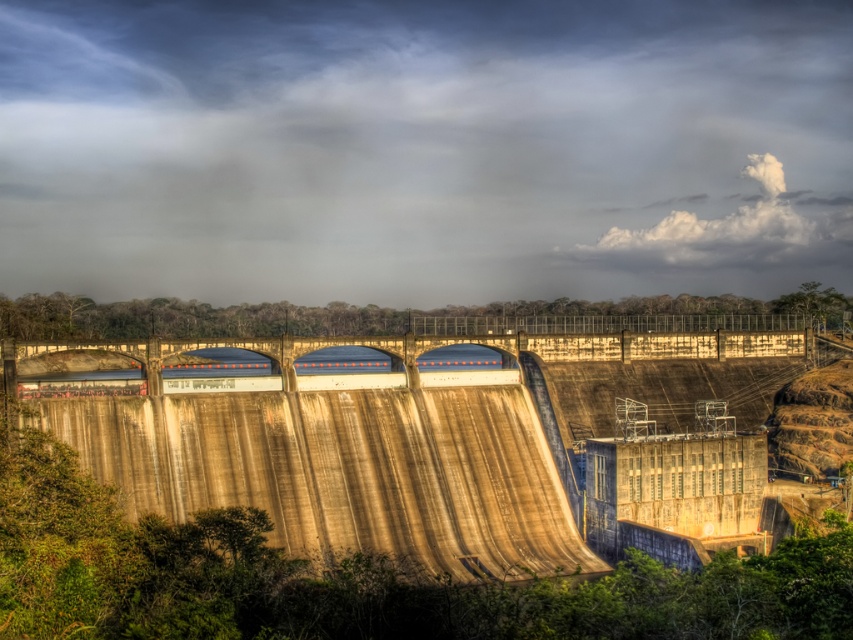
Who is taller, cloudy sky at upper center or concrete dam at center?

cloudy sky at upper center

Where is `cloudy sky at upper center`? This screenshot has width=853, height=640. cloudy sky at upper center is located at coordinates [x=422, y=148].